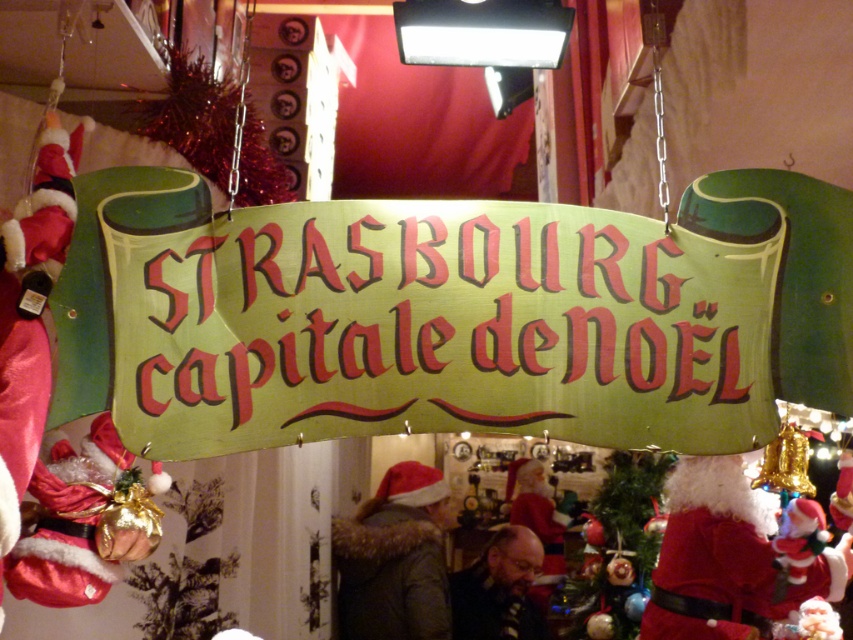
Does point (611, 404) come behind point (675, 621)?

No, it is not.

You are a GUI agent. You are given a task and a screenshot of the screen. Output one action in this format:
    pyautogui.click(x=<x>, y=<y>)
    Task: Click on the green paper sign at center
    Image resolution: width=853 pixels, height=640 pixels.
    Given the screenshot: What is the action you would take?
    pyautogui.click(x=444, y=324)

At what (x,y) coordinates should I click in order to perform the action: click on green paper sign at center. Please return your answer as a coordinate pair (x, y). The image size is (853, 640). Looking at the image, I should click on (444, 324).